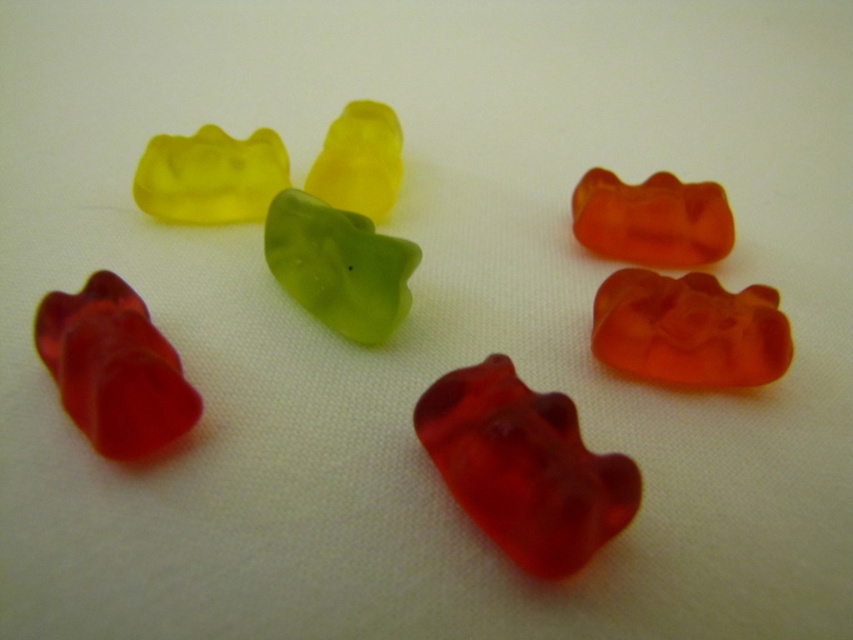
Does translucent amber gummy bear at upper right appear on the left side of yellow translucent bear at upper left?

In fact, translucent amber gummy bear at upper right is to the right of yellow translucent bear at upper left.

Between translucent amber gummy bear at upper right and yellow translucent bear at upper left, which one appears on the right side from the viewer's perspective?

translucent amber gummy bear at upper right is more to the right.

Measure the distance between translucent amber gummy bear at upper right and camera.

translucent amber gummy bear at upper right is 4.69 feet from camera.

The image size is (853, 640). In order to click on translucent amber gummy bear at upper right in this screenshot , I will do `click(651, 220)`.

Based on the photo, is translucent orange gummy bear at center right to the left of green translucent gummy bear at center from the viewer's perspective?

No, translucent orange gummy bear at center right is not to the left of green translucent gummy bear at center.

Which is more to the right, translucent orange gummy bear at center right or green translucent gummy bear at center?

translucent orange gummy bear at center right is more to the right.

Which is in front, point (651, 282) or point (361, 296)?

Positioned in front is point (361, 296).

You are a GUI agent. You are given a task and a screenshot of the screen. Output one action in this format:
    pyautogui.click(x=<x>, y=<y>)
    Task: Click on the translucent orange gummy bear at center right
    The image size is (853, 640).
    Given the screenshot: What is the action you would take?
    pyautogui.click(x=689, y=330)

Who is shorter, translucent red gummy bear at lower left or green translucent gummy bear at center?

With less height is green translucent gummy bear at center.

Image resolution: width=853 pixels, height=640 pixels. What are the coordinates of `translucent red gummy bear at lower left` in the screenshot? It's located at (114, 369).

Is point (45, 355) positioned in front of point (311, 200)?

Yes, point (45, 355) is in front of point (311, 200).

Where is `translucent red gummy bear at lower left`? This screenshot has width=853, height=640. translucent red gummy bear at lower left is located at coordinates (114, 369).